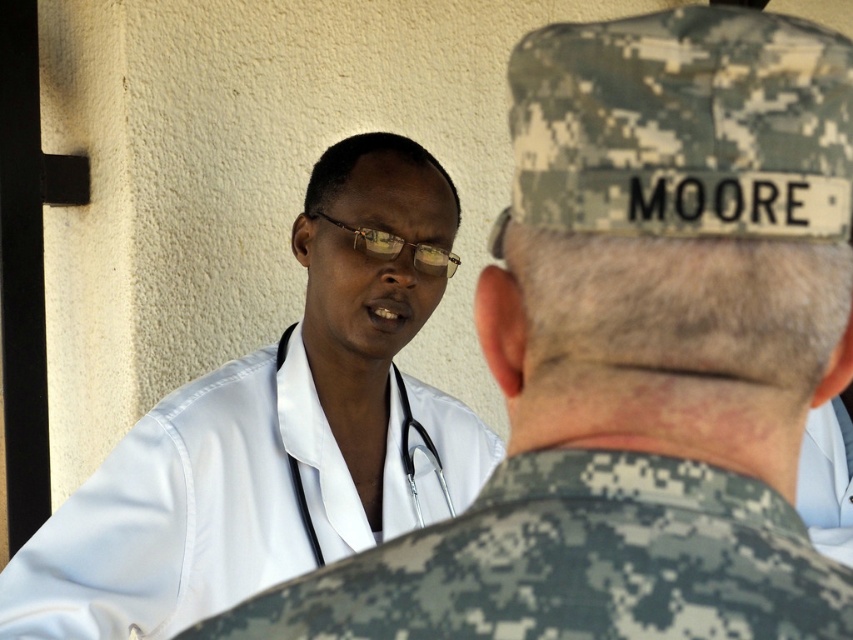
Find the location of a particular element. The height and width of the screenshot is (640, 853). digital camouflage uniform at center is located at coordinates (573, 563).

Is digital camouflage uniform at center taller than metallic silver stethoscope at center?

No, digital camouflage uniform at center is not taller than metallic silver stethoscope at center.

Describe the element at coordinates (573, 563) in the screenshot. I see `digital camouflage uniform at center` at that location.

I want to click on digital camouflage uniform at center, so click(573, 563).

Which is in front, point (456, 460) or point (403, 433)?

Positioned in front is point (403, 433).

I want to click on white smooth lab coat at upper left, so click(200, 509).

Is point (33, 550) behind point (438, 460)?

No.

This screenshot has height=640, width=853. I want to click on white smooth lab coat at upper left, so click(200, 509).

Which of these two, digital camouflage uniform at center or white smooth lab coat at upper left, stands shorter?

digital camouflage uniform at center is shorter.

Between digital camouflage uniform at center and white smooth lab coat at upper left, which one is positioned lower?

white smooth lab coat at upper left is lower down.

Does point (630, 588) come in front of point (236, 458)?

That is True.

Identify the location of digital camouflage uniform at center. The width and height of the screenshot is (853, 640). (573, 563).